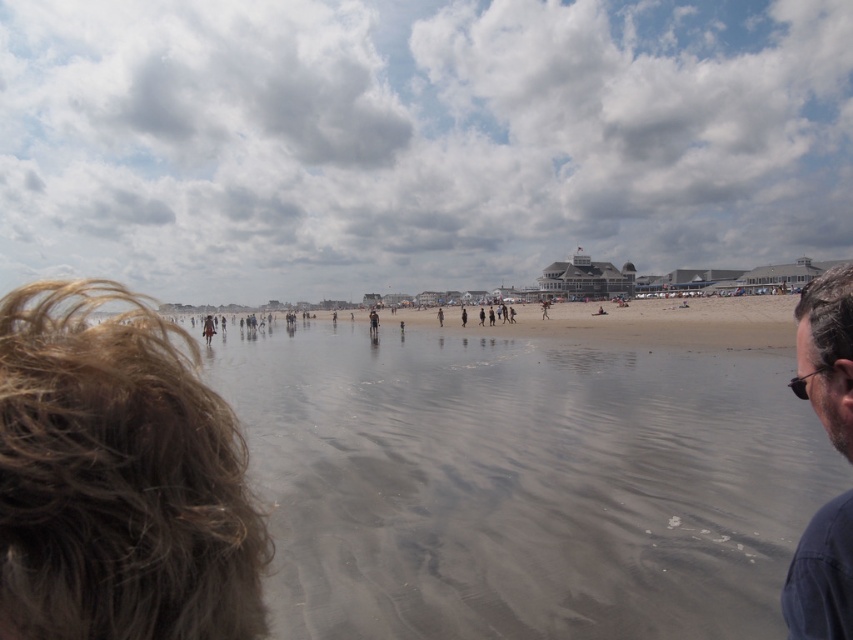
Question: Does brown fuzzy hair at lower left have a smaller size compared to dark blue shirt at right?

Choices:
 (A) yes
 (B) no

Answer: (A)

Question: Can you confirm if gray sand at lower center is positioned to the left of brown fuzzy hair at lower left?

Choices:
 (A) yes
 (B) no

Answer: (B)

Question: Which of the following is the closest to the observer?

Choices:
 (A) dark blue shirt at right
 (B) brown fuzzy hair at lower left

Answer: (B)

Question: Does gray sand at lower center have a larger size compared to dark blue shirt at right?

Choices:
 (A) yes
 (B) no

Answer: (A)

Question: Based on their relative distances, which object is farther from the brown fuzzy hair at lower left?

Choices:
 (A) gray sand at lower center
 (B) dark blue shirt at right

Answer: (A)

Question: Estimate the real-world distances between objects in this image. Which object is farther from the dark blue shirt at right?

Choices:
 (A) gray sand at lower center
 (B) brown fuzzy hair at lower left

Answer: (A)